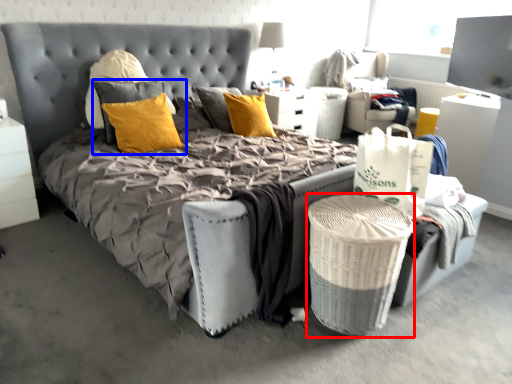
Question: Which of the following is the closest to the observer, laundry basket (highlighted by a red box) or pillow (highlighted by a blue box)?

Choices:
 (A) laundry basket
 (B) pillow

Answer: (A)